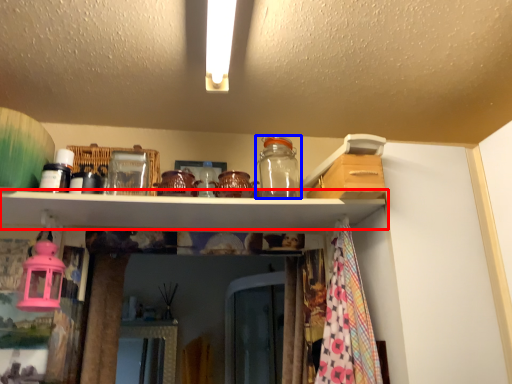
Question: Which point is closer to the camera, shelf (highlighted by a red box) or glass jar (highlighted by a blue box)?

Choices:
 (A) shelf
 (B) glass jar

Answer: (A)